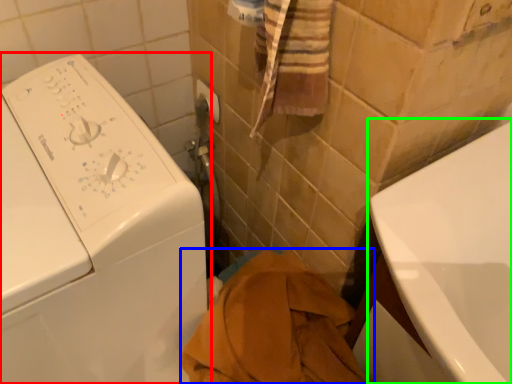
Question: Which object is the closest to the washing machine (highlighted by a red box)? Choose among these: bath towel (highlighted by a blue box) or bath (highlighted by a green box).

Choices:
 (A) bath towel
 (B) bath

Answer: (A)